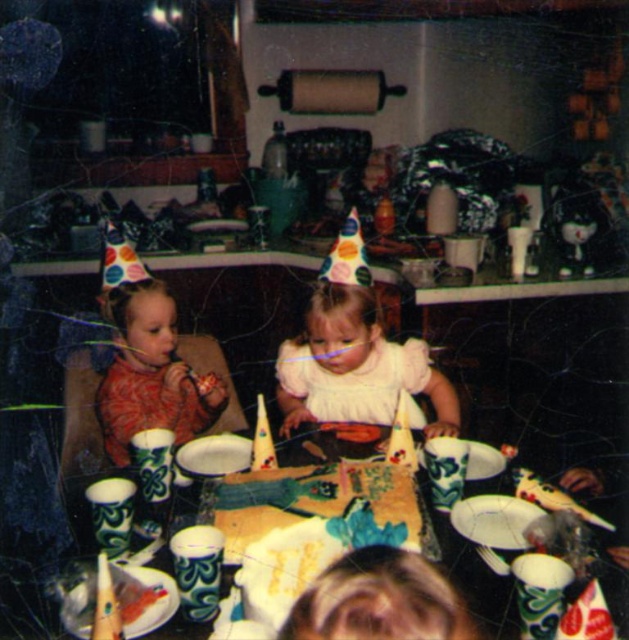
Question: Does white satin dress at center appear on the right side of matte red dress at left?

Choices:
 (A) yes
 (B) no

Answer: (A)

Question: Does matte red dress at left appear on the left side of green textured cups at center?

Choices:
 (A) yes
 (B) no

Answer: (A)

Question: Which point is closer to the camera?

Choices:
 (A) white satin dress at center
 (B) matte red dress at left
 (C) green textured cups at center

Answer: (C)

Question: Which point appears closest to the camera in this image?

Choices:
 (A) (213, 372)
 (B) (369, 355)

Answer: (A)

Question: Does white satin dress at center have a greater width compared to green textured cups at center?

Choices:
 (A) yes
 (B) no

Answer: (B)

Question: Estimate the real-world distances between objects in this image. Which object is farther from the white satin dress at center?

Choices:
 (A) green textured cups at center
 (B) matte red dress at left

Answer: (A)